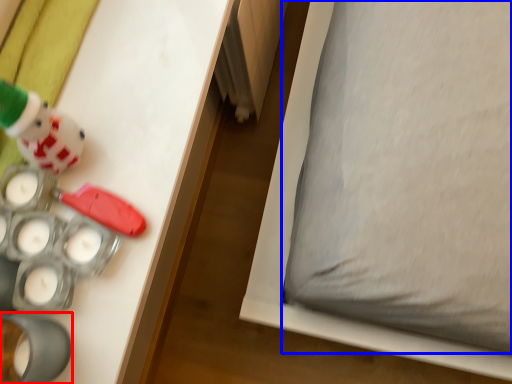
Question: Which of the following is the closest to the observer, toy (highlighted by a red box) or pillow (highlighted by a blue box)?

Choices:
 (A) toy
 (B) pillow

Answer: (A)